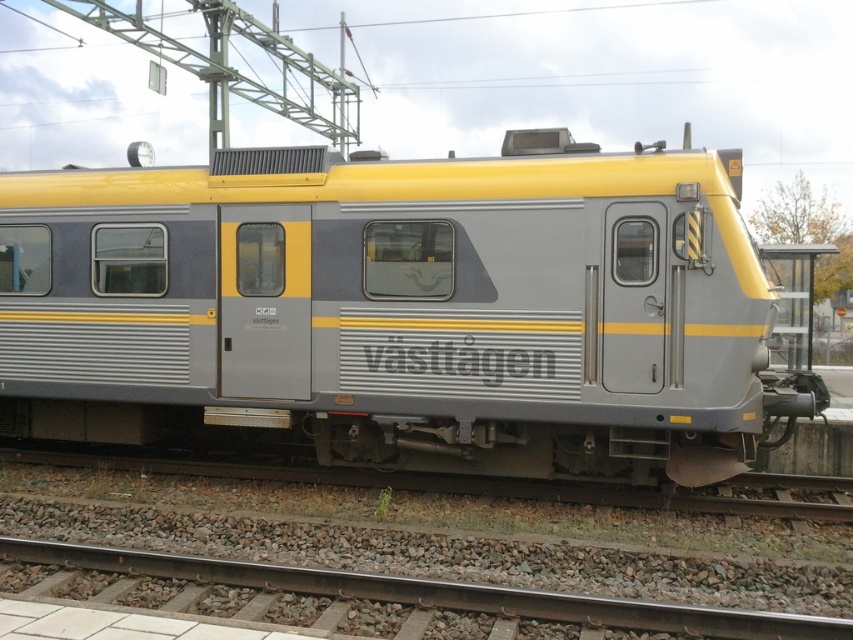
Question: Is metallic gray train at center to the right of gravel at lower center from the viewer's perspective?

Choices:
 (A) yes
 (B) no

Answer: (A)

Question: Which of the following is the farthest from the observer?

Choices:
 (A) (302, 420)
 (B) (281, 564)

Answer: (A)

Question: Does metallic gray train at center have a smaller size compared to gravel at lower center?

Choices:
 (A) yes
 (B) no

Answer: (B)

Question: Which object is closer to the camera taking this photo?

Choices:
 (A) gravel at lower center
 (B) metallic gray train at center

Answer: (A)

Question: In this image, where is metallic gray train at center located relative to gravel at lower center?

Choices:
 (A) above
 (B) below

Answer: (A)

Question: Among these objects, which one is nearest to the camera?

Choices:
 (A) gravel at lower center
 (B) metallic gray train at center

Answer: (A)